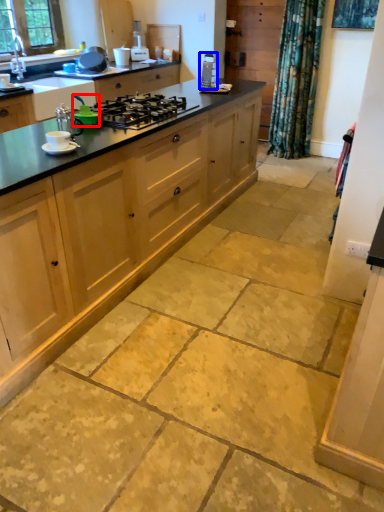
Question: Which point is closer to the camera, appliance (highlighted by a red box) or appliance (highlighted by a blue box)?

Choices:
 (A) appliance
 (B) appliance

Answer: (A)